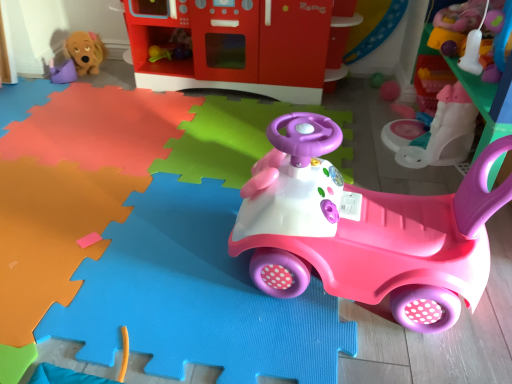
Question: Is smooth plastic toy at upper right, which is the 6th toy in left-to-right order, in front of pink plastic walker at upper right, which is counted as the fifth toy, starting from the left?

Choices:
 (A) no
 (B) yes

Answer: (B)

Question: From the image's perspective, is smooth plastic toy at upper right, placed as the first toy when sorted from right to left, located beneath pink plastic walker at upper right, the second toy positioned from the right?

Choices:
 (A) yes
 (B) no

Answer: (B)

Question: Is smooth plastic toy at upper right, which is the 6th toy in left-to-right order, next to pink plastic walker at upper right, the second toy positioned from the right, and touching it?

Choices:
 (A) no
 (B) yes

Answer: (A)

Question: From a real-world perspective, is smooth plastic toy at upper right, which is the 6th toy in left-to-right order, below pink plastic walker at upper right, which is counted as the fifth toy, starting from the left?

Choices:
 (A) yes
 (B) no

Answer: (B)

Question: Can you confirm if smooth plastic toy at upper right, which is the 6th toy in left-to-right order, is smaller than pink plastic walker at upper right, the second toy positioned from the right?

Choices:
 (A) no
 (B) yes

Answer: (B)

Question: Considering the positions of pink plastic car at center, which is the fourth toy from left to right, and matte plastic play kitchen at upper center, which ranks as the third toy in left-to-right order, in the image, is pink plastic car at center, which is the fourth toy from left to right, wider or thinner than matte plastic play kitchen at upper center, which ranks as the third toy in left-to-right order,?

Choices:
 (A) wide
 (B) thin

Answer: (B)

Question: Is point (281, 122) closer or farther from the camera than point (176, 31)?

Choices:
 (A) closer
 (B) farther

Answer: (A)

Question: From a real-world perspective, is pink plastic car at center, which is the fourth toy from left to right, above or below matte plastic play kitchen at upper center, which is the 4th toy from right to left?

Choices:
 (A) below
 (B) above

Answer: (A)

Question: From their relative heights in the image, would you say pink plastic car at center, the third toy when ordered from right to left, is taller or shorter than matte plastic play kitchen at upper center, which ranks as the third toy in left-to-right order?

Choices:
 (A) tall
 (B) short

Answer: (B)

Question: Based on their positions, is matte plastic play kitchen at upper center, which ranks as the third toy in left-to-right order, located to the left or right of pink plastic walker at upper right, the second toy positioned from the right?

Choices:
 (A) right
 (B) left

Answer: (B)

Question: Is matte plastic play kitchen at upper center, which ranks as the third toy in left-to-right order, taller or shorter than pink plastic walker at upper right, which is counted as the fifth toy, starting from the left?

Choices:
 (A) short
 (B) tall

Answer: (B)

Question: From the image's perspective, is matte plastic play kitchen at upper center, which ranks as the third toy in left-to-right order, located above or below pink plastic walker at upper right, which is counted as the fifth toy, starting from the left?

Choices:
 (A) above
 (B) below

Answer: (A)

Question: From a real-world perspective, relative to pink plastic walker at upper right, the second toy positioned from the right, is matte plastic play kitchen at upper center, which ranks as the third toy in left-to-right order, vertically above or below?

Choices:
 (A) below
 (B) above

Answer: (B)

Question: Is point (403, 163) closer or farther from the camera than point (69, 44)?

Choices:
 (A) farther
 (B) closer

Answer: (B)

Question: In terms of height, does pink plastic walker at upper right, which is counted as the fifth toy, starting from the left, look taller or shorter compared to brown plush dog at upper left, which is the fifth toy from right to left?

Choices:
 (A) tall
 (B) short

Answer: (A)